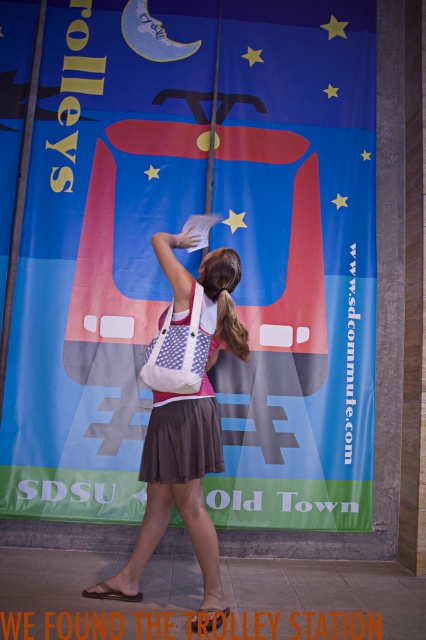
Question: Does white canvas bag at center lie in front of brown cotton dress at center?

Choices:
 (A) no
 (B) yes

Answer: (B)

Question: Can you confirm if matte red trolley at center is thinner than brown silky hair at center?

Choices:
 (A) yes
 (B) no

Answer: (B)

Question: Can you confirm if white canvas bag at center is thinner than brown silky hair at center?

Choices:
 (A) no
 (B) yes

Answer: (A)

Question: Which point is closer to the camera taking this photo?

Choices:
 (A) (204, 288)
 (B) (178, 413)
 (C) (215, 253)

Answer: (B)

Question: Which point is farther from the camera taking this photo?

Choices:
 (A) (216, 333)
 (B) (92, 136)

Answer: (B)

Question: Which of these objects is positioned farthest from the brown silky hair at center?

Choices:
 (A) white canvas bag at center
 (B) brown cotton dress at center

Answer: (B)